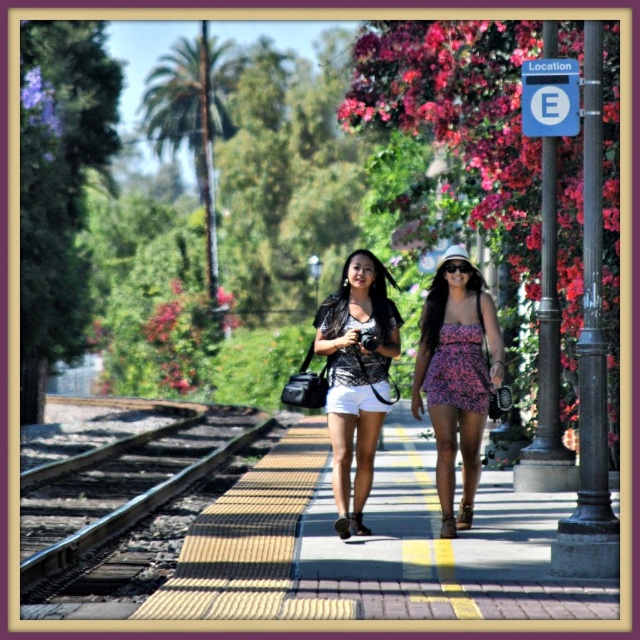
In the scene shown: You are standing on the train platform and see two points marked on the ground. The first point is at coordinate point (109, 609) and the second is at point (445, 278). If you were to walk towards the train tracks on the left, which point would you step on first?

Point (109, 609) is in front of point (445, 278), so you would step on point (109, 609) first as you walk towards the train tracks on the left.

Consider the image. You are standing at the point marked by the coordinates point (x=131, y=513). What object is located at this point?

The point (x=131, y=513) indicates dark brown wooden train track at lower left.

You are a photographer standing on the platform and want to take a photo of the matte black top at center. The camera you have can focus on objects up to 5 meters away. Is the dark brown wooden train track at lower left within the camera focus range?

The dark brown wooden train track at lower left is 4.08 meters away from matte black top at center. Since the camera can focus up to 5 meters, the dark brown wooden train track at lower left is within the focus range.